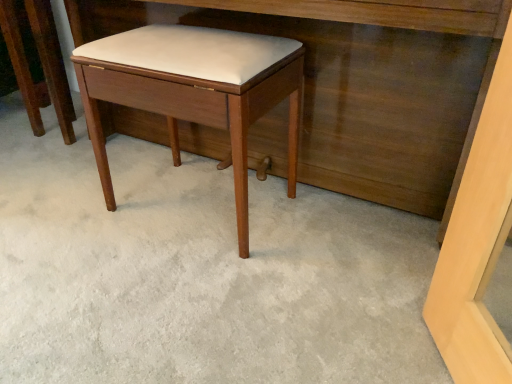
The width and height of the screenshot is (512, 384). I want to click on vacant area situated to the left side of matte wood stool at center, so click(73, 209).